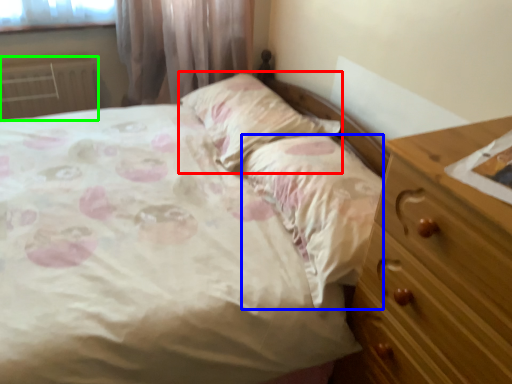
Question: Based on their relative distances, which object is farther from pillow (highlighted by a red box)? Choose from sheet (highlighted by a blue box) and radiator (highlighted by a green box).

Choices:
 (A) sheet
 (B) radiator

Answer: (B)